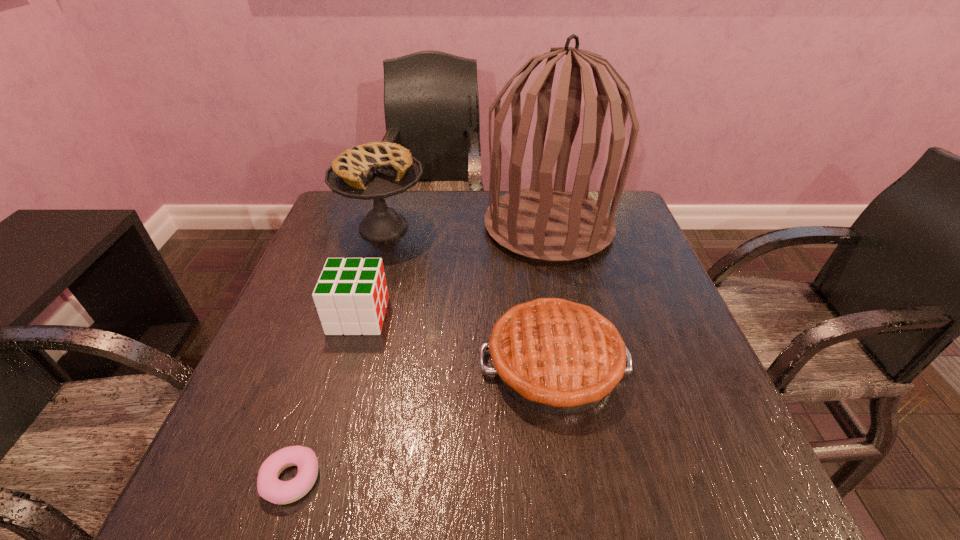
Where is `free space between the taller pie and the tallest object`? The width and height of the screenshot is (960, 540). free space between the taller pie and the tallest object is located at coordinates (467, 227).

The image size is (960, 540). What are the coordinates of `free space between the pastry and the birdcage` in the screenshot? It's located at (420, 353).

Where is `vacant space that is in between the cube and the tallest object`? This screenshot has width=960, height=540. vacant space that is in between the cube and the tallest object is located at coordinates (454, 271).

Find the location of a particular element. The width and height of the screenshot is (960, 540). free spot between the nearer pie and the cube is located at coordinates (456, 340).

Where is `free space between the nearest object and the taller pie`? free space between the nearest object and the taller pie is located at coordinates (337, 353).

At what (x,y) coordinates should I click in order to perform the action: click on empty location between the cube and the tallest object. Please return your answer as a coordinate pair (x, y). This screenshot has height=540, width=960. Looking at the image, I should click on pyautogui.click(x=454, y=271).

This screenshot has height=540, width=960. In order to click on free space between the tallest object and the cube in this screenshot , I will do `click(454, 271)`.

Identify the location of free point between the fourth shortest object and the nearer pie. The width and height of the screenshot is (960, 540). (468, 295).

At what (x,y) coordinates should I click in order to perform the action: click on free spot between the cube and the nearest object. Please return your answer as a coordinate pair (x, y). Looking at the image, I should click on (324, 397).

The height and width of the screenshot is (540, 960). I want to click on object identified as the closest to the cube, so click(377, 170).